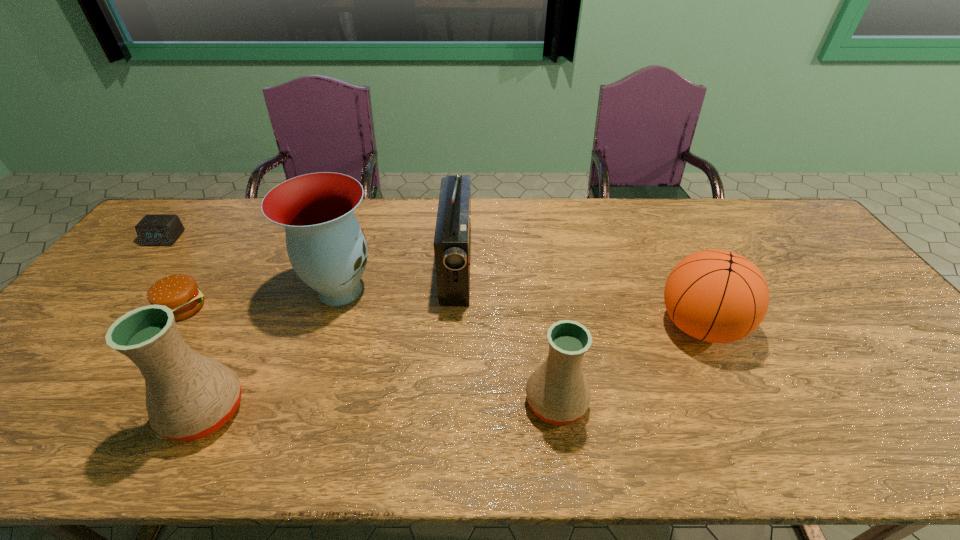
This screenshot has height=540, width=960. What are the coordinates of `empty space that is in between the leftmost object and the fourth object from right to left` in the screenshot? It's located at (252, 264).

At what (x,y) coordinates should I click in order to perform the action: click on vacant space that is in between the taller pottery and the second object from right to left. Please return your answer as a coordinate pair (x, y). Looking at the image, I should click on (381, 407).

Find the location of `free point between the shorter pottery and the second shortest object`. free point between the shorter pottery and the second shortest object is located at coordinates (370, 355).

This screenshot has width=960, height=540. Identify the location of empty location between the hamburger and the second object from right to left. (370, 355).

Find the location of a particular element. Image resolution: width=960 pixels, height=540 pixels. the sixth closest object to the fourth object from left to right is located at coordinates [x=718, y=296].

I want to click on object that is the fourth closest one to the shortest object, so click(452, 242).

In order to click on free space that satisfies the following two spatial constraints: 1. on the back side of the second object from right to left; 2. on the front-facing side of the radio receiver in this screenshot , I will do `click(537, 268)`.

I want to click on free space that satisfies the following two spatial constraints: 1. on the back side of the second object from left to right; 2. on the left side of the fourth object from right to left, so click(x=195, y=290).

This screenshot has height=540, width=960. I want to click on free space that satisfies the following two spatial constraints: 1. on the front-facing side of the second object from left to right; 2. on the right side of the shortest object, so click(106, 307).

Image resolution: width=960 pixels, height=540 pixels. I want to click on vacant space that satisfies the following two spatial constraints: 1. on the back side of the rightmost object; 2. on the front-facing side of the radio receiver, so click(672, 268).